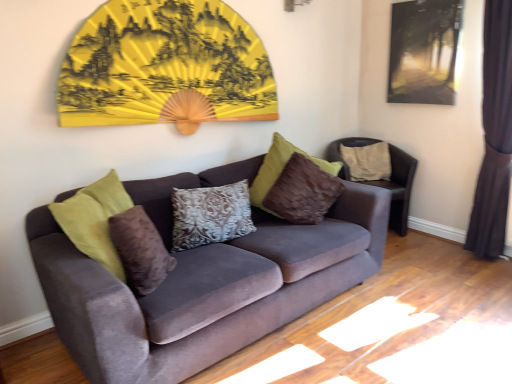
Locate an element on the screen. The width and height of the screenshot is (512, 384). vacant space in between velvet couch at center and dark brown velvet curtain at right is located at coordinates (397, 290).